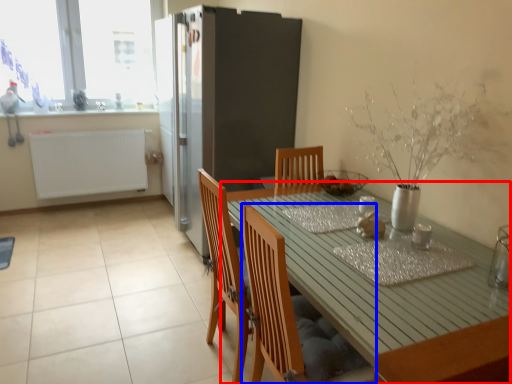
Question: Which of the following is the closest to the observer, table (highlighted by a red box) or chair (highlighted by a blue box)?

Choices:
 (A) table
 (B) chair

Answer: (A)